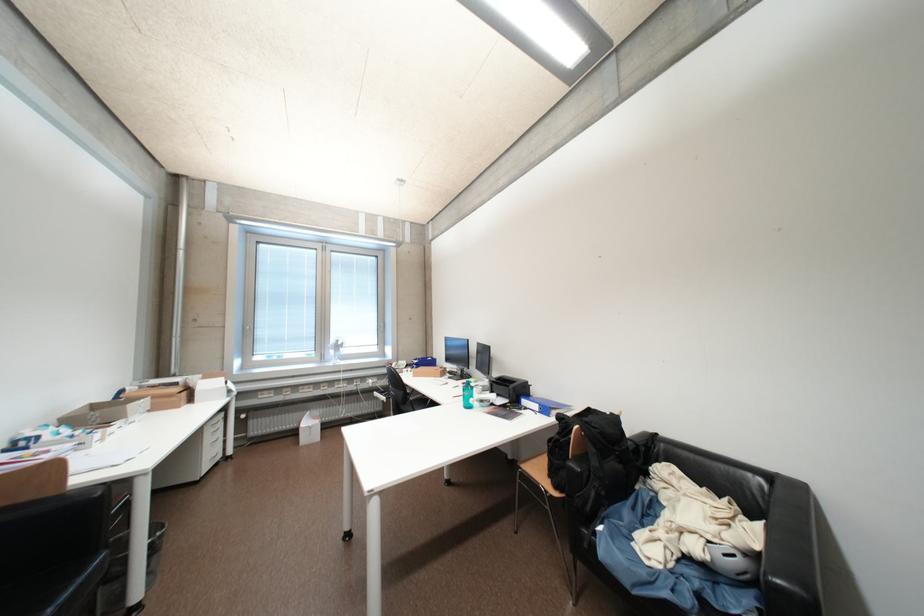
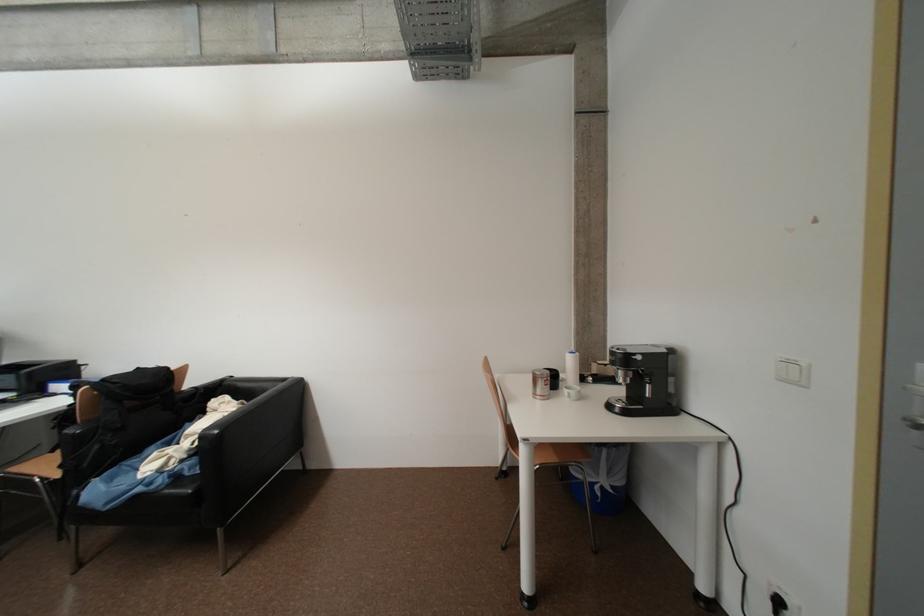
Question: I am providing you with two images of the same scene from different viewpoints. Please identify which objects are invisible in image2.

Choices:
 (A) chair sitting surface
 (B) sofa sitting surface
 (C) grey floor pillow
 (D) silver door handle

Answer: (B)